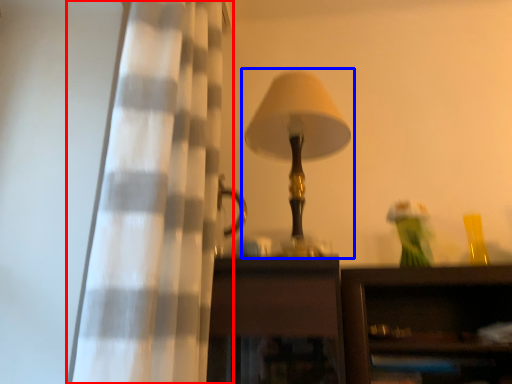
Question: Which point is closer to the camera, curtain (highlighted by a red box) or lamp (highlighted by a blue box)?

Choices:
 (A) curtain
 (B) lamp

Answer: (A)